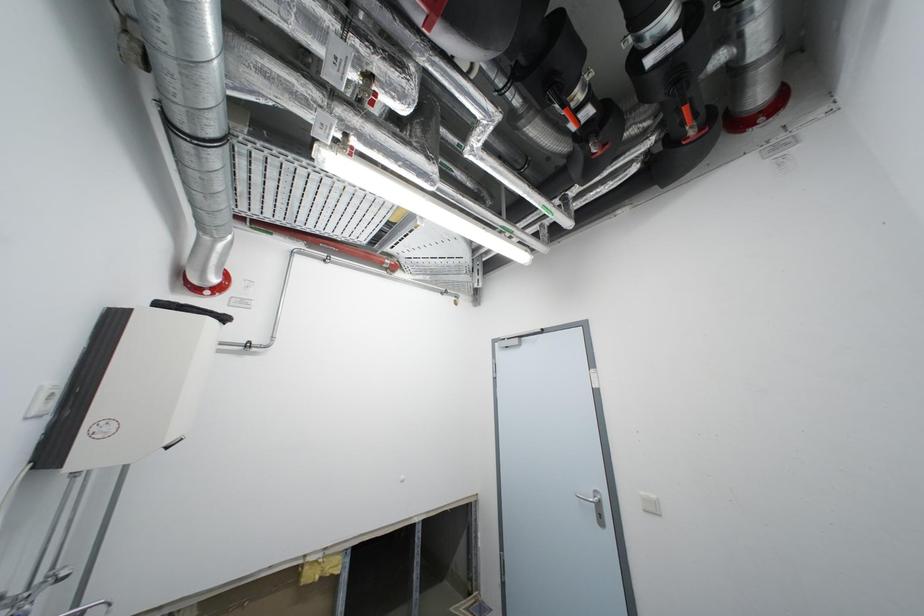
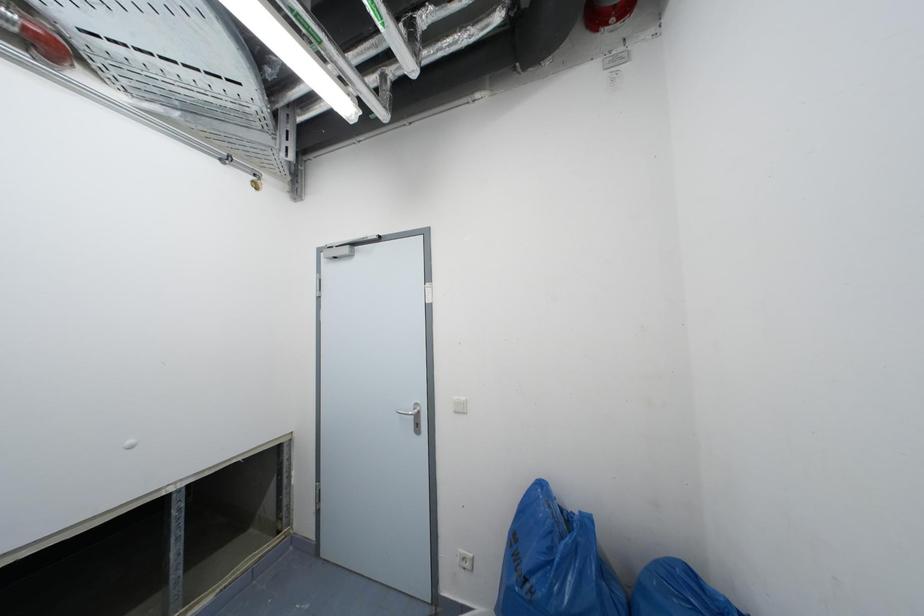
Question: The images are taken continuously from a first-person perspective. In which direction is your viewpoint rotating?

Choices:
 (A) Left
 (B) Right
 (C) Up
 (D) Down

Answer: (B)